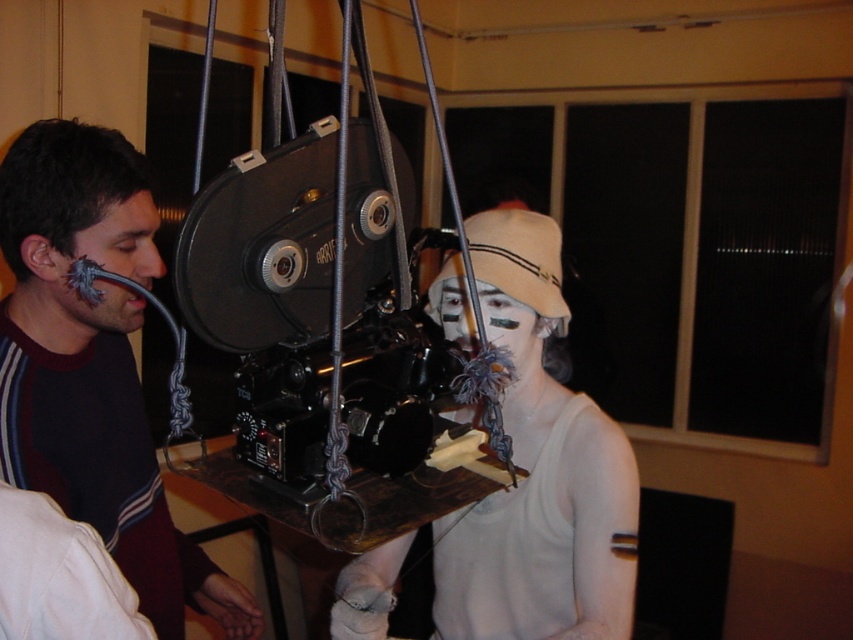
You are an assistant helping to set up the workshop. The matte black shirt at center needs to be moved to the left side of the projector. Is it currently positioned to the right or left of the projector?

The matte black shirt at center is located at point (93, 365), which is to the right of the projector. Therefore, it needs to be moved to the left side of the projector.